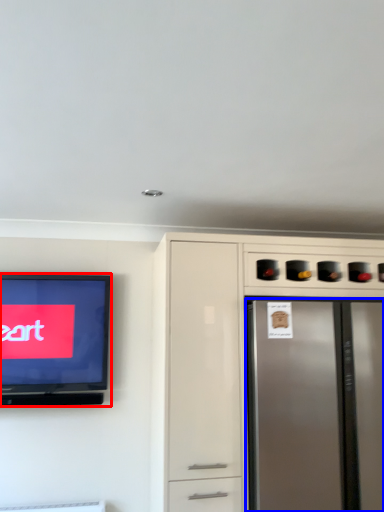
Question: Which of the following is the closest to the observer, television (highlighted by a red box) or refrigerator (highlighted by a blue box)?

Choices:
 (A) television
 (B) refrigerator

Answer: (B)